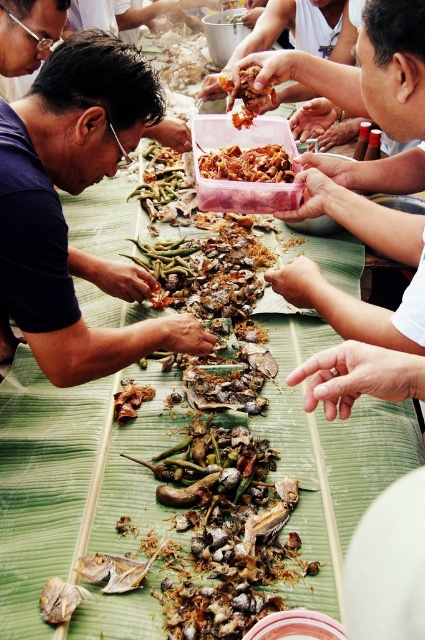
Question: Estimate the real-world distances between objects in this image. Which object is farther from the spicy brown meat at center?

Choices:
 (A) shiny brown meat at center
 (B) dark blue shirt at left

Answer: (B)

Question: Among these objects, which one is nearest to the camera?

Choices:
 (A) shiny brown meat at center
 (B) dark blue shirt at left

Answer: (B)

Question: Can you confirm if dark blue shirt at left is positioned to the right of shiny brown meat at center?

Choices:
 (A) no
 (B) yes

Answer: (A)

Question: Is shiny brown meat at center below spicy brown meat at center?

Choices:
 (A) no
 (B) yes

Answer: (B)

Question: Which point is closer to the camera?

Choices:
 (A) dark blue shirt at left
 (B) shiny brown meat at center

Answer: (A)

Question: Is shiny brown meat at center thinner than spicy brown meat at center?

Choices:
 (A) yes
 (B) no

Answer: (B)